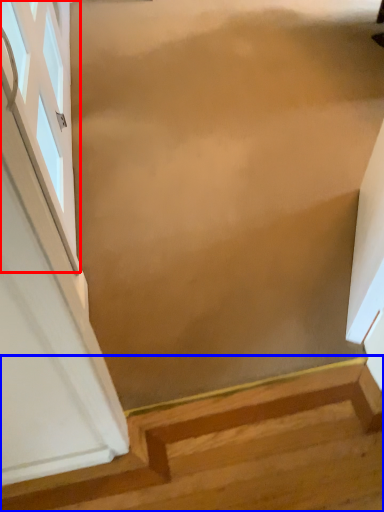
Question: Which point is further to the camera, window (highlighted by a red box) or stairs (highlighted by a blue box)?

Choices:
 (A) window
 (B) stairs

Answer: (A)